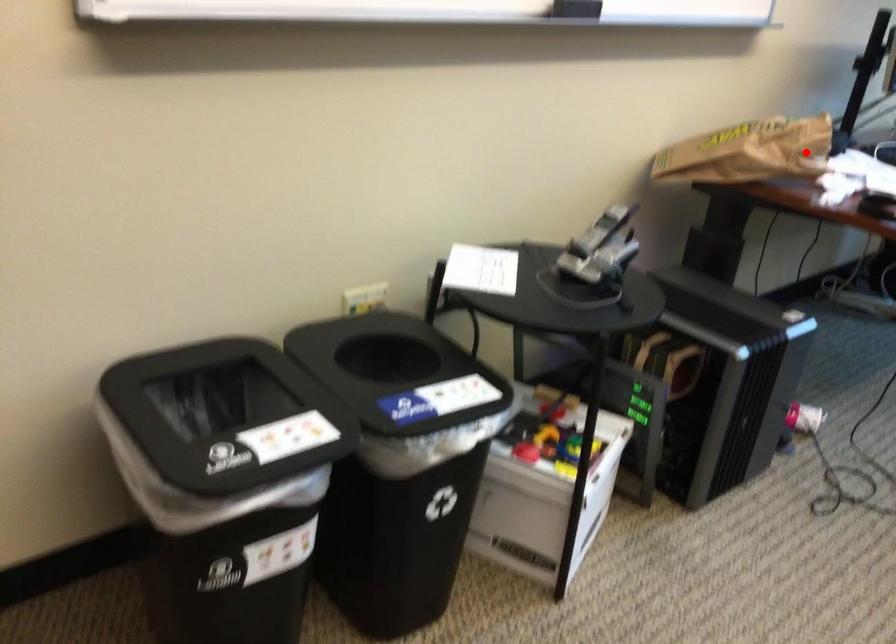
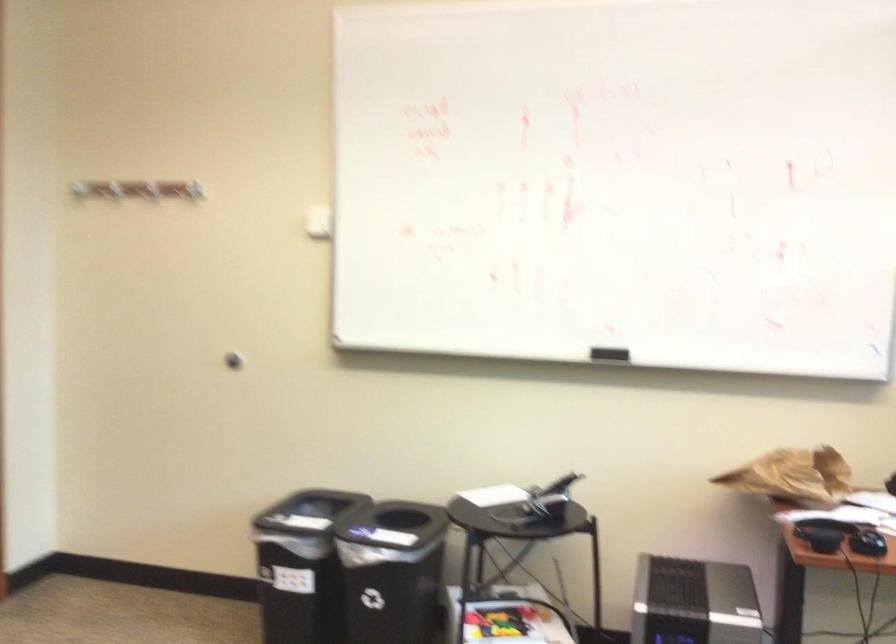
Question: I am providing you with two images of the same scene from different viewpoints. In image1, a red point is highlighted. Considering the same 3D point in image2, which of the following is correct?

Choices:
 (A) It is closer
 (B) It is farther

Answer: (B)